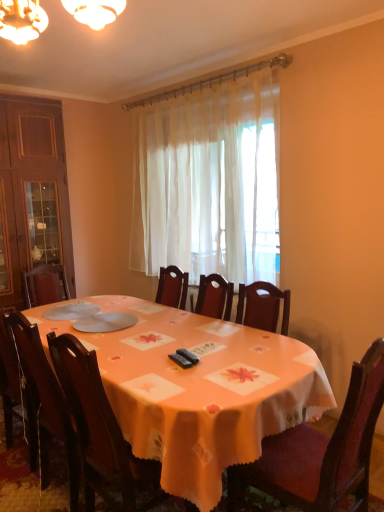
In order to click on orange fabric table at center in this screenshot , I will do `click(199, 390)`.

Image resolution: width=384 pixels, height=512 pixels. I want to click on wooden chair at center, acting as the 2th chair starting from the left, so click(100, 431).

Is white matte plates at center wider or thinner than wooden chair at lower right, which is counted as the first chair, starting from the right?

Clearly, white matte plates at center has less width compared to wooden chair at lower right, which is counted as the first chair, starting from the right.

Is white matte plates at center far from wooden chair at lower right, the 3th chair in the left-to-right sequence?

Yes, white matte plates at center and wooden chair at lower right, the 3th chair in the left-to-right sequence, are quite far apart.

Can you tell me how much white matte plates at center and wooden chair at lower right, the 3th chair in the left-to-right sequence, differ in facing direction?

90.1 degrees separate the facing orientations of white matte plates at center and wooden chair at lower right, the 3th chair in the left-to-right sequence.

Which is behind, white matte plates at center or wooden chair at lower right, which is counted as the first chair, starting from the right?

white matte plates at center is behind.

From the picture: Is orange fabric table at center in contact with white matte plates at center?

No, orange fabric table at center is not with white matte plates at center.

Would you say orange fabric table at center is outside white matte plates at center?

orange fabric table at center lies outside white matte plates at center's area.

Is orange fabric table at center shorter than white matte plates at center?

No, orange fabric table at center is not shorter than white matte plates at center.

Can you confirm if orange fabric table at center is thinner than white matte plates at center?

No.

At what (x,y) coordinates should I click in order to perform the action: click on table located behind the wooden chair at lower right, the 3th chair in the left-to-right sequence. Please return your answer as a coordinate pair (x, y). The height and width of the screenshot is (512, 384). Looking at the image, I should click on (199, 390).

From a real-world perspective, which object stands above the other?

In real-world perspective, wooden chair at lower right, the 3th chair in the left-to-right sequence, is above.

Does point (334, 465) lie behind point (185, 378)?

No, it is not.

Who is bigger, wooden chair at lower right, the 3th chair in the left-to-right sequence, or orange fabric table at center?

orange fabric table at center is bigger.

Considering the sizes of objects wooden chair at lower right, the 3th chair in the left-to-right sequence, and dark wood chair at lower left, the third chair in the right-to-left sequence, in the image provided, who is taller, wooden chair at lower right, the 3th chair in the left-to-right sequence, or dark wood chair at lower left, the third chair in the right-to-left sequence,?

wooden chair at lower right, the 3th chair in the left-to-right sequence.

Which of these two, wooden chair at lower right, the 3th chair in the left-to-right sequence, or dark wood chair at lower left, which ranks as the 1th chair in left-to-right order, is thinner?

dark wood chair at lower left, which ranks as the 1th chair in left-to-right order.

Is wooden chair at lower right, the 3th chair in the left-to-right sequence, facing away from dark wood chair at lower left, which ranks as the 1th chair in left-to-right order?

That's not correct — wooden chair at lower right, the 3th chair in the left-to-right sequence, is not looking away from dark wood chair at lower left, which ranks as the 1th chair in left-to-right order.

Is wooden chair at lower right, which is counted as the first chair, starting from the right, bigger or smaller than dark wood chair at lower left, which ranks as the 1th chair in left-to-right order?

Clearly, wooden chair at lower right, which is counted as the first chair, starting from the right, is larger in size than dark wood chair at lower left, which ranks as the 1th chair in left-to-right order.

From the image's perspective, is dark wood chair at lower left, which ranks as the 1th chair in left-to-right order, below wooden chair at lower right, which is counted as the first chair, starting from the right?

Actually, dark wood chair at lower left, which ranks as the 1th chair in left-to-right order, appears above wooden chair at lower right, which is counted as the first chair, starting from the right, in the image.

Which object is further away from the camera, dark wood chair at lower left, which ranks as the 1th chair in left-to-right order, or wooden chair at lower right, which is counted as the first chair, starting from the right?

dark wood chair at lower left, which ranks as the 1th chair in left-to-right order, is further away from the camera.

Which is correct: dark wood chair at lower left, the third chair in the right-to-left sequence, is inside wooden chair at lower right, which is counted as the first chair, starting from the right, or outside of it?

dark wood chair at lower left, the third chair in the right-to-left sequence, is outside wooden chair at lower right, which is counted as the first chair, starting from the right.

In the scene shown: Is dark wood chair at lower left, which ranks as the 1th chair in left-to-right order, far away from wooden chair at lower right, which is counted as the first chair, starting from the right?

Yes, dark wood chair at lower left, which ranks as the 1th chair in left-to-right order, and wooden chair at lower right, which is counted as the first chair, starting from the right, are quite far apart.

Which object is positioned more to the left, orange fabric table at center or wooden chair at center, acting as the 2th chair starting from the left?

Answer: Positioned to the left is orange fabric table at center.

The height and width of the screenshot is (512, 384). There is a orange fabric table at center. In order to click on the 1st chair above it (from the image's perspective) in this screenshot , I will do `click(100, 431)`.

Is orange fabric table at center facing away from wooden chair at center, the second chair when ordered from right to left?

Absolutely, orange fabric table at center is directed away from wooden chair at center, the second chair when ordered from right to left.

Which is nearer, (x=271, y=356) or (x=96, y=401)?

Point (x=96, y=401)

Is sheer white curtain at center facing towards wooden chair at center, acting as the 2th chair starting from the left?

Yes, sheer white curtain at center faces towards wooden chair at center, acting as the 2th chair starting from the left.

Is sheer white curtain at center shorter than wooden chair at center, the second chair when ordered from right to left?

No.

Is sheer white curtain at center far away from wooden chair at center, acting as the 2th chair starting from the left?

sheer white curtain at center is far away from wooden chair at center, acting as the 2th chair starting from the left.

Measure the distance from sheer white curtain at center to wooden chair at center, the second chair when ordered from right to left.

sheer white curtain at center and wooden chair at center, the second chair when ordered from right to left, are 5.84 feet apart from each other.

Image resolution: width=384 pixels, height=512 pixels. I want to click on the 3rd chair in front of the white matte plates at center, so click(321, 451).

Where is `table below the white matte plates at center (from the image's perspective)`? This screenshot has height=512, width=384. table below the white matte plates at center (from the image's perspective) is located at coordinates (199, 390).

Based on their spatial positions, is sheer white curtain at center or orange fabric table at center further from white matte plates at center?

sheer white curtain at center.

Considering their positions, is orange fabric table at center positioned further to wooden chair at lower right, which is counted as the first chair, starting from the right, than wooden chair at center, the second chair when ordered from right to left?

wooden chair at center, the second chair when ordered from right to left, lies further to wooden chair at lower right, which is counted as the first chair, starting from the right, than the other object.

When comparing their distances from dark wood chair at lower left, the third chair in the right-to-left sequence, does orange fabric table at center or wooden chair at center, acting as the 2th chair starting from the left, seem closer?

wooden chair at center, acting as the 2th chair starting from the left.

Which object lies further to the anchor point white matte plates at center, sheer white curtain at center or wooden chair at center, the second chair when ordered from right to left?

sheer white curtain at center lies further to white matte plates at center than the other object.

Estimate the real-world distances between objects in this image. Which object is closer to wooden chair at lower right, the 3th chair in the left-to-right sequence, white matte plates at center or dark wood chair at lower left, the third chair in the right-to-left sequence?

dark wood chair at lower left, the third chair in the right-to-left sequence, is closer to wooden chair at lower right, the 3th chair in the left-to-right sequence.

Which object lies nearer to the anchor point dark wood chair at lower left, the third chair in the right-to-left sequence, wooden chair at lower right, which is counted as the first chair, starting from the right, or sheer white curtain at center?

Among the two, wooden chair at lower right, which is counted as the first chair, starting from the right, is located nearer to dark wood chair at lower left, the third chair in the right-to-left sequence.

Based on the photo, estimate the real-world distances between objects in this image. Which object is closer to sheer white curtain at center, white matte plates at center or wooden chair at lower right, which is counted as the first chair, starting from the right?

white matte plates at center is closer to sheer white curtain at center.

Considering their positions, is wooden chair at center, acting as the 2th chair starting from the left, positioned further to wooden chair at lower right, which is counted as the first chair, starting from the right, than dark wood chair at lower left, the third chair in the right-to-left sequence?

Among the two, dark wood chair at lower left, the third chair in the right-to-left sequence, is located further to wooden chair at lower right, which is counted as the first chair, starting from the right.

The height and width of the screenshot is (512, 384). Identify the location of table between wooden chair at lower right, the 3th chair in the left-to-right sequence, and white matte plates at center from front to back. (199, 390).

At what (x,y) coordinates should I click in order to perform the action: click on tableware located between orange fabric table at center and sheer white curtain at center in the depth direction. Please return your answer as a coordinate pair (x, y). This screenshot has height=512, width=384. Looking at the image, I should click on (72, 311).

Where is `tableware between wooden chair at center, acting as the 2th chair starting from the left, and sheer white curtain at center in the front-back direction`? This screenshot has height=512, width=384. tableware between wooden chair at center, acting as the 2th chair starting from the left, and sheer white curtain at center in the front-back direction is located at coordinates (72, 311).

Where is `tableware between sheer white curtain at center and dark wood chair at lower left, which ranks as the 1th chair in left-to-right order, in the vertical direction`? tableware between sheer white curtain at center and dark wood chair at lower left, which ranks as the 1th chair in left-to-right order, in the vertical direction is located at coordinates (72, 311).